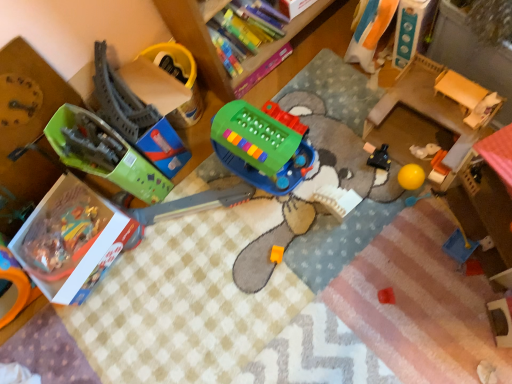
Identify the location of empty space that is in between green plastic toy at center, placed as the third toy when sorted from left to right, and black plastic toy at center-right, which is the 5th toy in left-to-right order. The height and width of the screenshot is (384, 512). (337, 164).